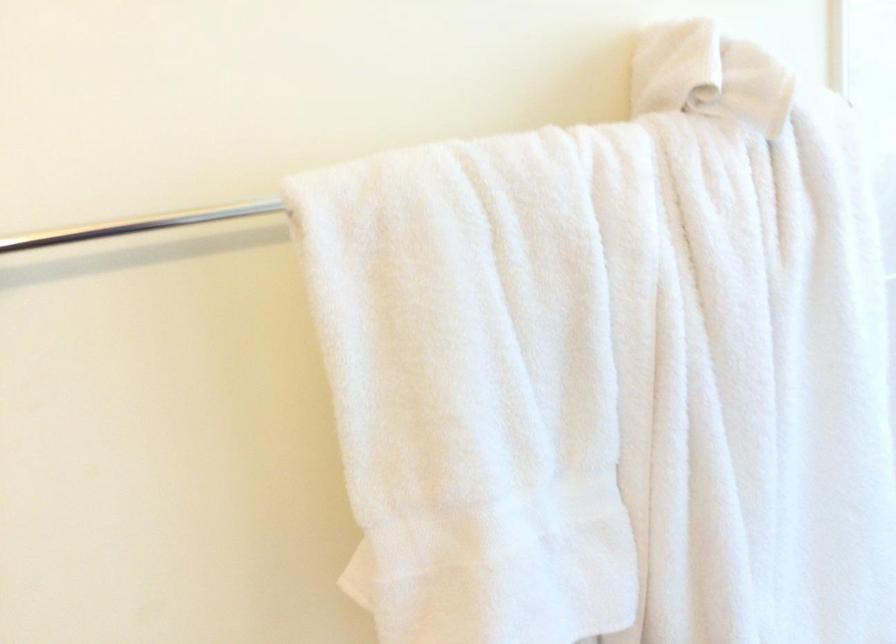
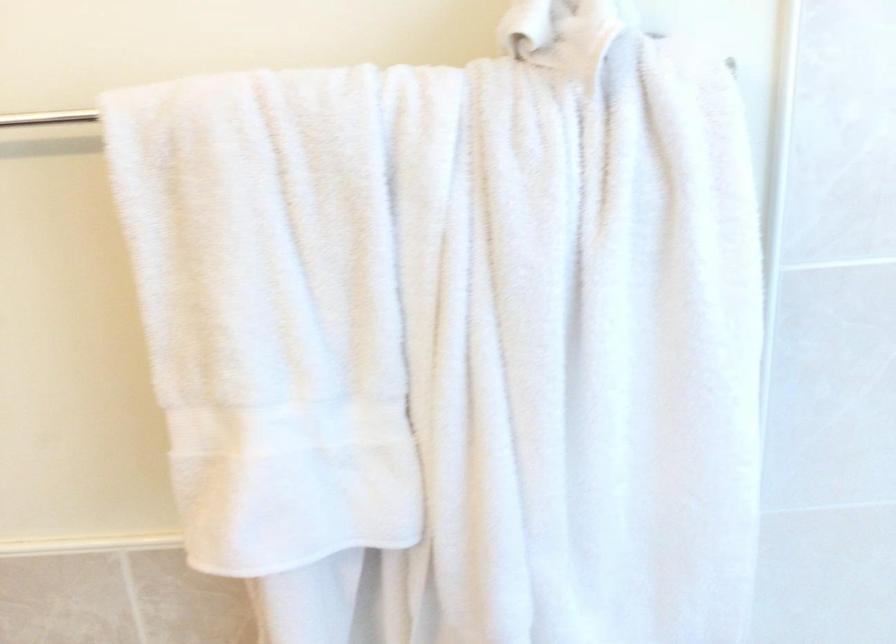
Question: In a continuous first-person perspective shot, in which direction is the camera moving?

Choices:
 (A) Left
 (B) Right
 (C) Forward
 (D) Backward

Answer: (B)